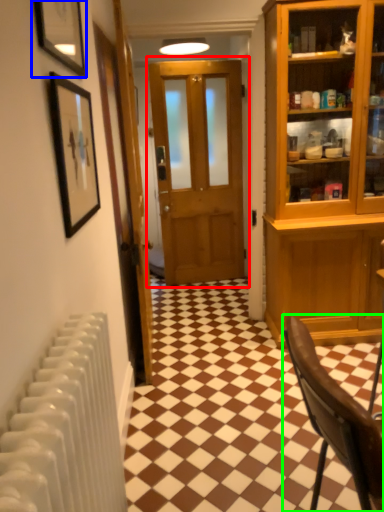
Question: Considering the real-world distances, which object is closest to door (highlighted by a red box)? picture frame (highlighted by a blue box) or chair (highlighted by a green box).

Choices:
 (A) picture frame
 (B) chair

Answer: (A)